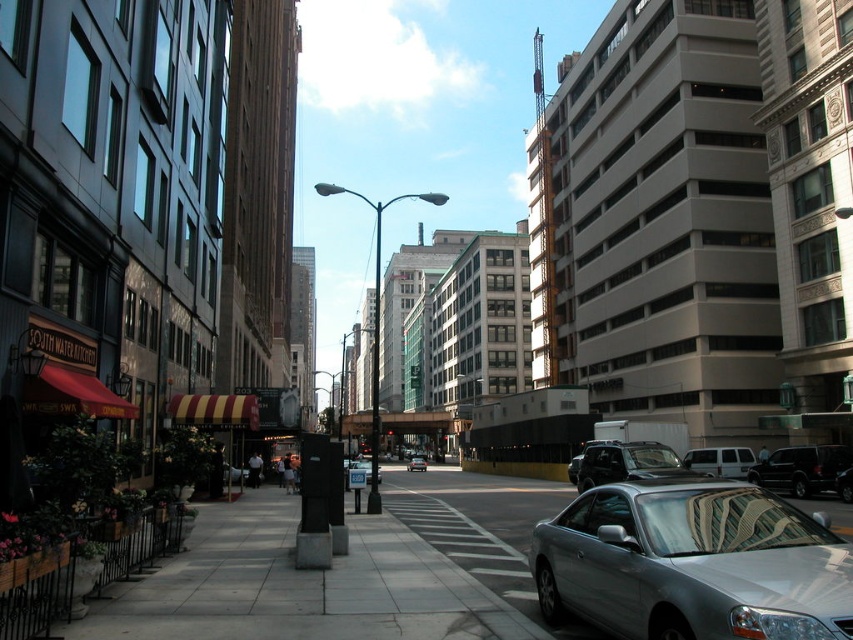
Question: Which is nearer to the shiny black suv at right?

Choices:
 (A) silver metallic car at center-right
 (B) gray concrete sidewalk at center

Answer: (B)

Question: Is white matte van at center below silver metallic sedan at center?

Choices:
 (A) no
 (B) yes

Answer: (A)

Question: Is shiny black suv at center to the right of silver metallic car at center from the viewer's perspective?

Choices:
 (A) yes
 (B) no

Answer: (A)

Question: Which of the following is the farthest from the observer?

Choices:
 (A) white matte van at center
 (B) gray concrete sidewalk at center
 (C) silver metallic car at center-right

Answer: (A)

Question: Is shiny black suv at right to the right of silver metallic sedan at center from the viewer's perspective?

Choices:
 (A) yes
 (B) no

Answer: (A)

Question: Which point appears farthest from the camera in this image?

Choices:
 (A) (415, 468)
 (B) (624, 470)

Answer: (A)